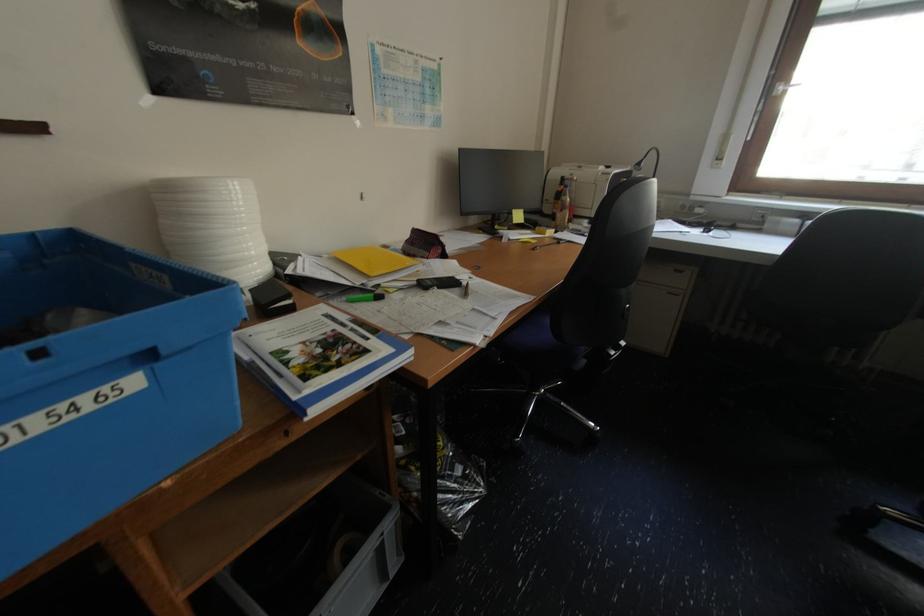
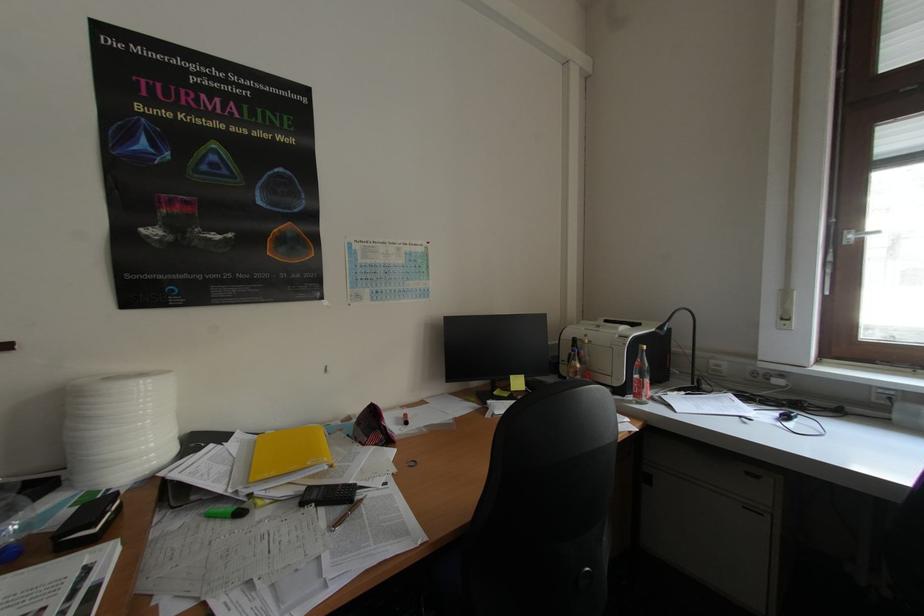
Based on the photo, the images are taken continuously from a first-person perspective. In which direction is your viewpoint rotating?

The rotation direction of the camera is left-up.